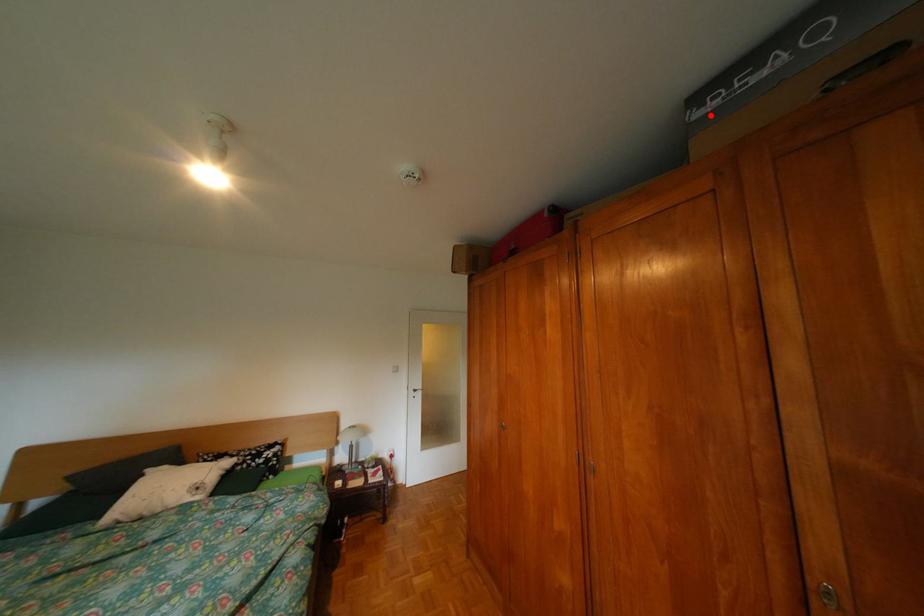
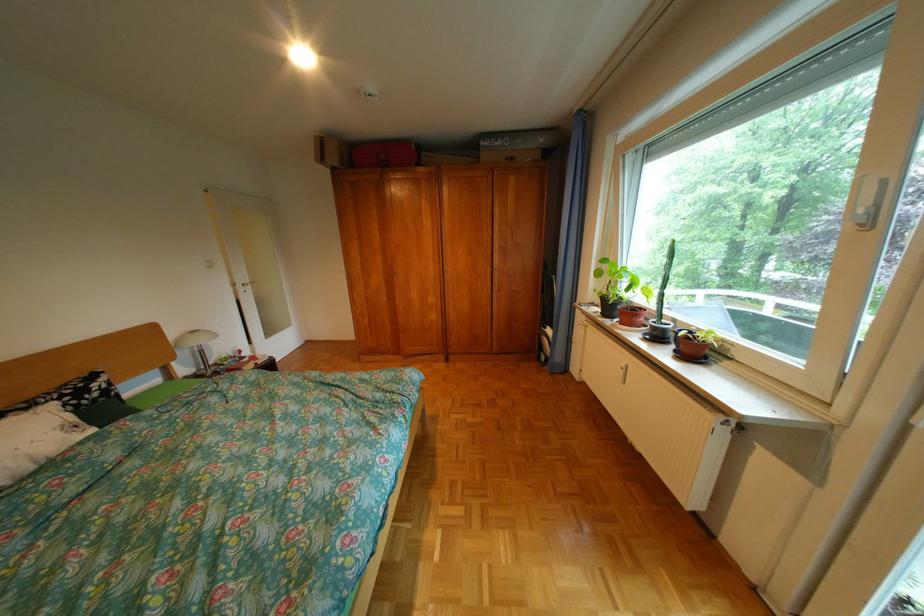
Where in the second image is the point corresponding to the highlighted location from the first image?

(497, 145)